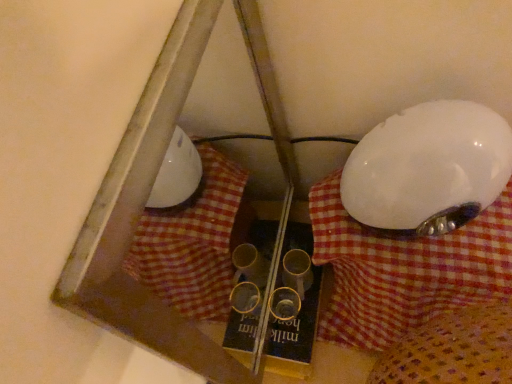
What do you see at coordinates (295, 336) in the screenshot?
I see `yellow cardboard book at center` at bounding box center [295, 336].

What is the approximate width of white glossy lampshade at right?

white glossy lampshade at right is 6.04 inches wide.

What is the approximate height of white checkered fabric at center?

white checkered fabric at center is 7.50 inches tall.

Identify the location of white checkered fabric at center. The width and height of the screenshot is (512, 384). click(404, 270).

You are a GUI agent. You are given a task and a screenshot of the screen. Output one action in this format:
    pyautogui.click(x=<x>, y=<y>)
    Task: Click on the yellow cardboard book at center
    
    Given the screenshot: What is the action you would take?
    pyautogui.click(x=295, y=336)

Is white glossy lampshade at right positioned beyond the bounds of yellow cardboard book at center?

Yes, white glossy lampshade at right is outside of yellow cardboard book at center.

Considering the positions of objects white glossy lampshade at right and yellow cardboard book at center in the image provided, who is behind, white glossy lampshade at right or yellow cardboard book at center?

yellow cardboard book at center is further from the camera.

Considering the positions of point (465, 141) and point (301, 357), is point (465, 141) closer or farther from the camera than point (301, 357)?

Point (465, 141) appears to be closer to the viewer than point (301, 357).

How different are the orientations of white glossy lampshade at right and yellow cardboard book at center in degrees?

0.00215 degrees separate the facing orientations of white glossy lampshade at right and yellow cardboard book at center.

Is yellow cardboard book at center at the left side of white glossy lampshade at right?

Correct, you'll find yellow cardboard book at center to the left of white glossy lampshade at right.

What's the angular difference between yellow cardboard book at center and white glossy lampshade at right's facing directions?

The facing directions of yellow cardboard book at center and white glossy lampshade at right are 0.00215 degrees apart.

From a real-world perspective, is yellow cardboard book at center positioned under white glossy lampshade at right based on gravity?

Yes, from a real-world perspective, yellow cardboard book at center is under white glossy lampshade at right.

Between white checkered fabric at center and white glossy lampshade at right, which one has smaller width?

white glossy lampshade at right.

Which is further, (403, 306) or (358, 193)?

The point (403, 306) is more distant.

Is white checkered fabric at center to the left or to the right of white glossy lampshade at right in the image?

In the image, white checkered fabric at center appears on the right side of white glossy lampshade at right.

Is white glossy lampshade at right next to white checkered fabric at center?

Yes, white glossy lampshade at right and white checkered fabric at center clearly make contact.

Based on the photo, is white glossy lampshade at right positioned with its back to white checkered fabric at center?

white glossy lampshade at right does not have its back to white checkered fabric at center.

How much distance is there between white glossy lampshade at right and white checkered fabric at center?

They are 3.00 inches apart.

From a real-world perspective, which is physically above, white glossy lampshade at right or white checkered fabric at center?

From a 3D spatial view, white glossy lampshade at right is above.

Does white checkered fabric at center come in front of yellow cardboard book at center?

Yes, white checkered fabric at center is closer to the viewer.

From a real-world perspective, which is physically below, white checkered fabric at center or yellow cardboard book at center?

yellow cardboard book at center is physically lower.

From a real-world perspective, is yellow cardboard book at center on white checkered fabric at center?

No, from a real-world perspective, yellow cardboard book at center is not on top of white checkered fabric at center.

Can you confirm if yellow cardboard book at center is positioned to the left of white checkered fabric at center?

Yes, yellow cardboard book at center is to the left of white checkered fabric at center.

This screenshot has width=512, height=384. What are the coordinates of `tablecloth on the right of yellow cardboard book at center` in the screenshot? It's located at (404, 270).

Where is `lamp in front of the yellow cardboard book at center`? lamp in front of the yellow cardboard book at center is located at coordinates (428, 169).

Find the location of `lamp that is above the yellow cardboard book at center (from a real-world perspective)`. lamp that is above the yellow cardboard book at center (from a real-world perspective) is located at coordinates 428,169.

When comparing their distances from white glossy lampshade at right, does white checkered fabric at center or yellow cardboard book at center seem closer?

white checkered fabric at center lies closer to white glossy lampshade at right than the other object.

Which object lies nearer to the anchor point white checkered fabric at center, white glossy lampshade at right or yellow cardboard book at center?

white glossy lampshade at right.

Looking at the image, which one is located further to white glossy lampshade at right, yellow cardboard book at center or white checkered fabric at center?

Based on the image, yellow cardboard book at center appears to be further to white glossy lampshade at right.

From the image, which object appears to be farther from white checkered fabric at center, yellow cardboard book at center or white glossy lampshade at right?

The object further to white checkered fabric at center is yellow cardboard book at center.

Considering their positions, is white checkered fabric at center positioned further to yellow cardboard book at center than white glossy lampshade at right?

white glossy lampshade at right is further to yellow cardboard book at center.

Looking at the image, which one is located further to yellow cardboard book at center, white glossy lampshade at right or white checkered fabric at center?

The object further to yellow cardboard book at center is white glossy lampshade at right.

I want to click on lamp situated between yellow cardboard book at center and white checkered fabric at center from left to right, so click(x=428, y=169).